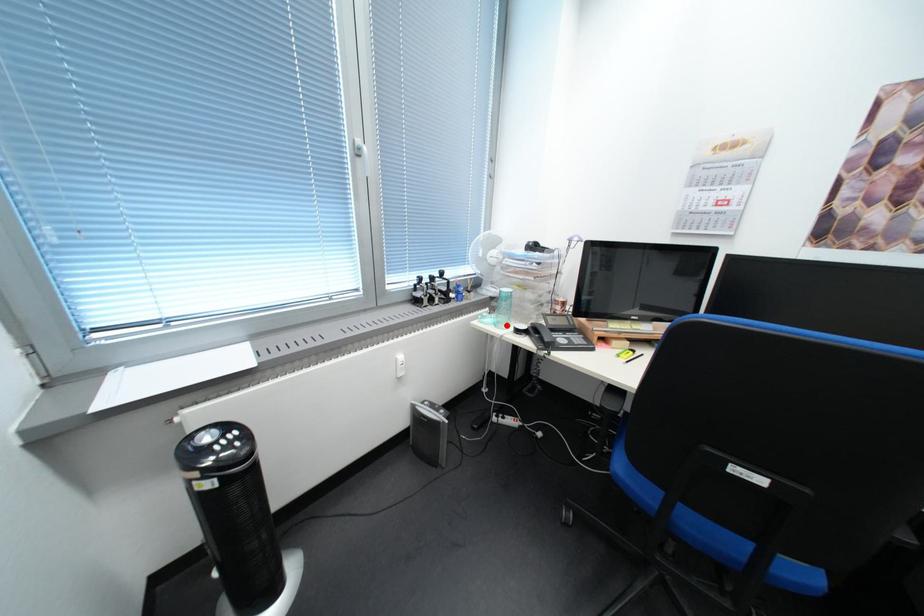
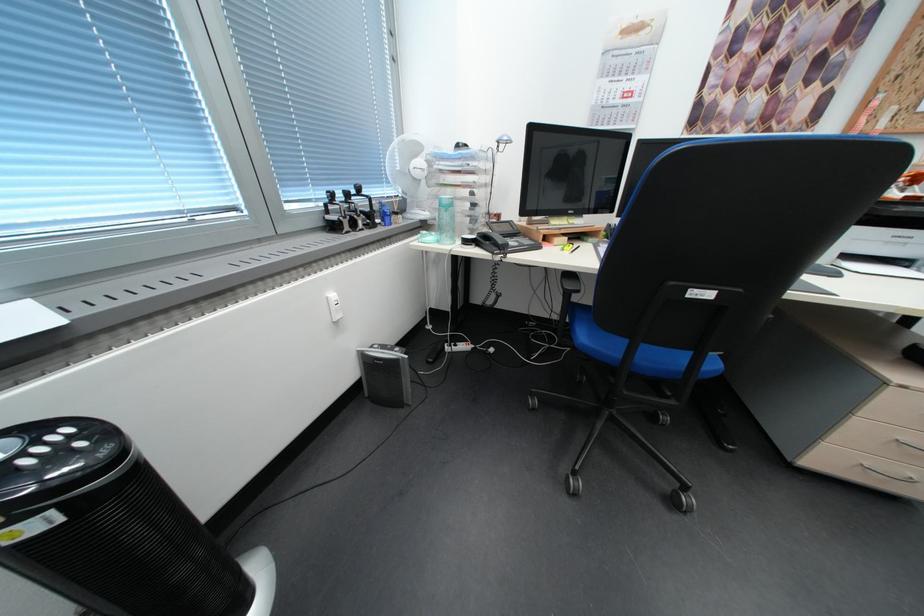
In the second image, find the point that corresponds to the highlighted location in the first image.

(450, 243)